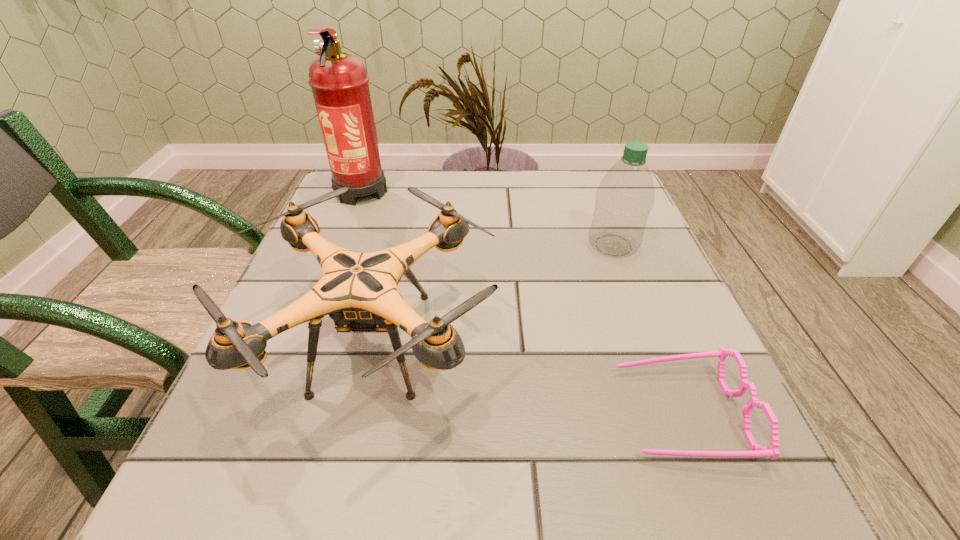
At what (x,y) coordinates should I click in order to perform the action: click on free region that satisfies the following two spatial constraints: 1. on the front-facing side of the farthest object; 2. on the right side of the third nearest object. Please return your answer as a coordinate pair (x, y). This screenshot has height=540, width=960. Looking at the image, I should click on (340, 245).